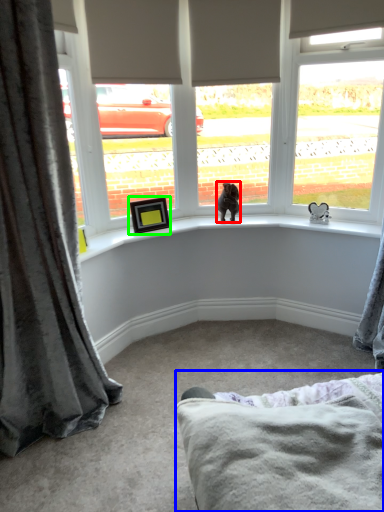
Question: Considering the real-world distances, which object is closest to animal (highlighted by a red box)? bedding (highlighted by a blue box) or picture frame (highlighted by a green box).

Choices:
 (A) bedding
 (B) picture frame

Answer: (B)